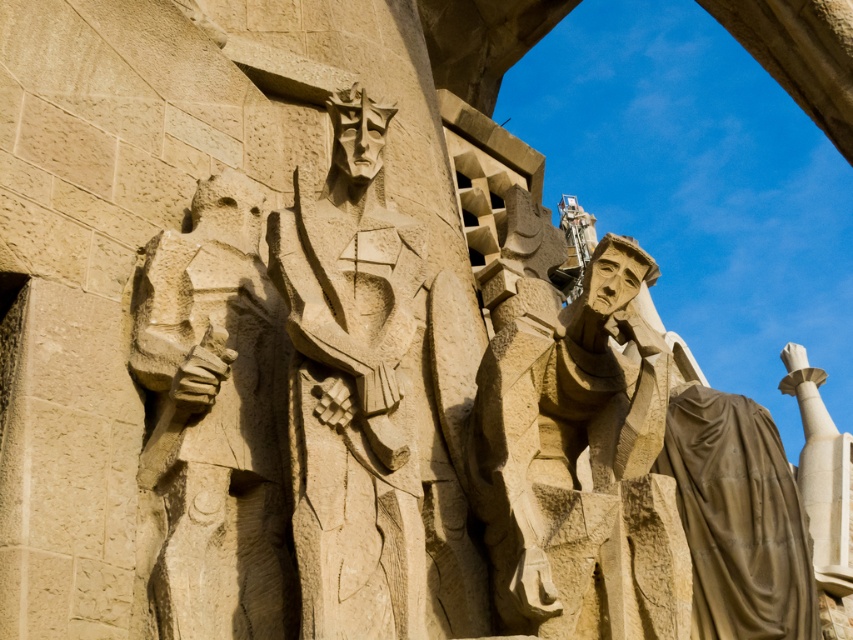
You are standing at the Sagrada Familia and want to take a photo of the central figure holding a book. The camera you are using has a focal length of 50mm and a sensor size of 24mm x 36mm. The point of interest is at point (442, 632). What is the minimum distance in meters you need to move towards the Sagrada Familia to ensure the central figure fills the frame vertically?

The point of interest at point (442, 632) is 61.90 meters away. To calculate the required distance, use the formula for field of view. The vertical field of view is 2 arctan. The current distance is 61.90 meters. The required distance would be calculated by rearranging the formula to solve for distance when the height of the subject equals the sensor height divided by the focal length. However, without knowing the height of the central figure, an exact calculation cannot be performed. Please provide the

You are standing in front of the Sagrada Familia and notice two points marked on the facade. The first point is at coordinates point (381, 609) and the second is at point (186, 616). Which point is closer to your current position?

Point (381, 609) is closer to the viewer than point (186, 616).